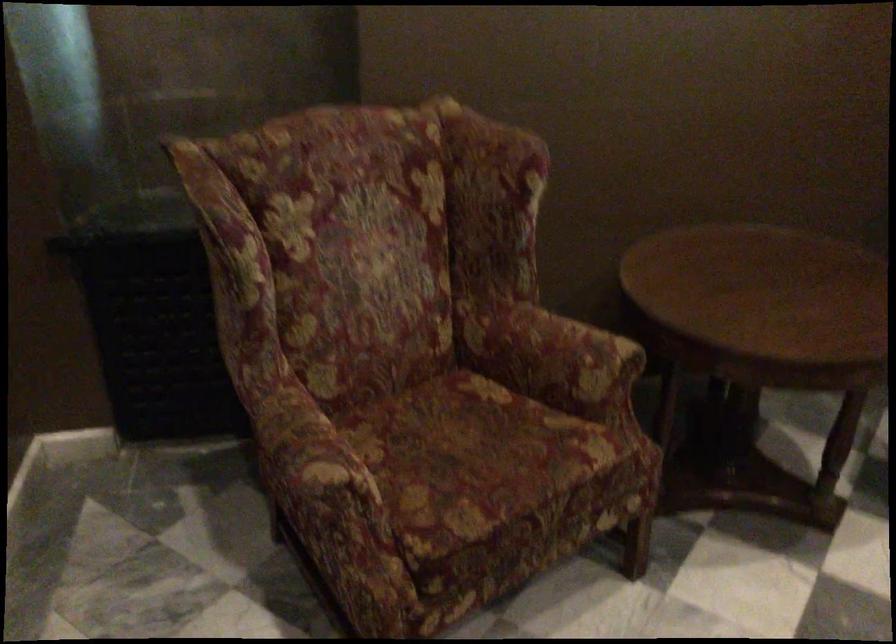
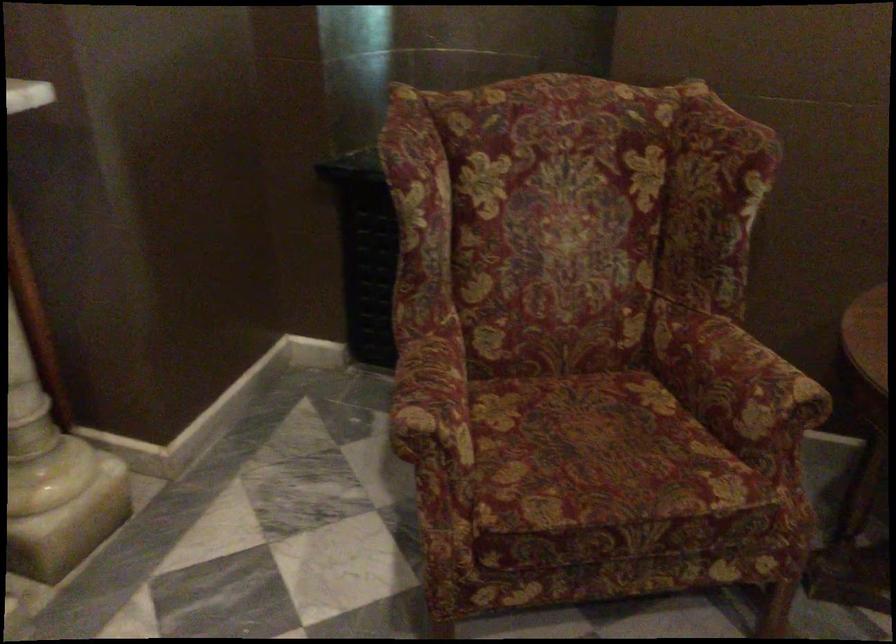
Question: What movement of the cameraman would produce the second image?

Choices:
 (A) Left
 (B) Right
 (C) Forward
 (D) Backward

Answer: (B)